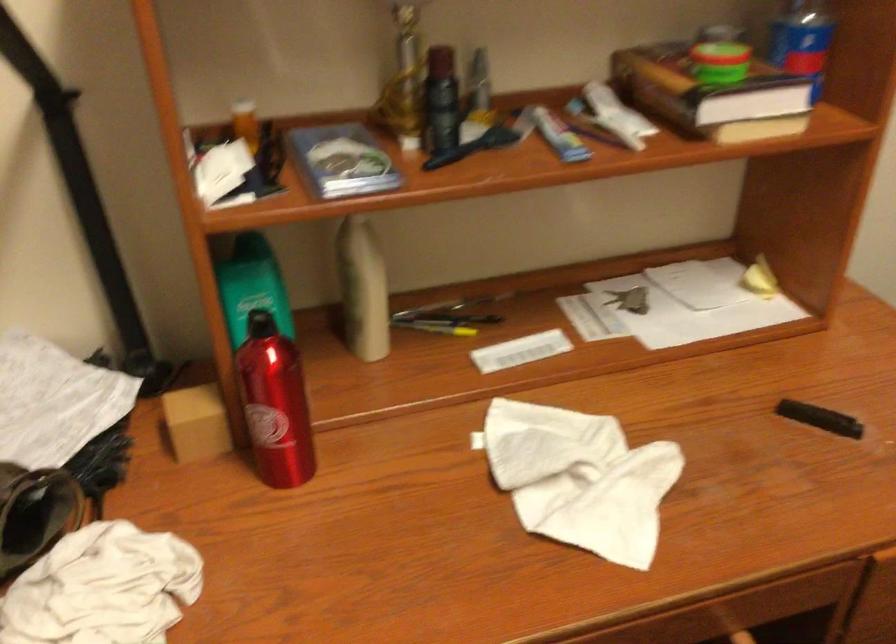
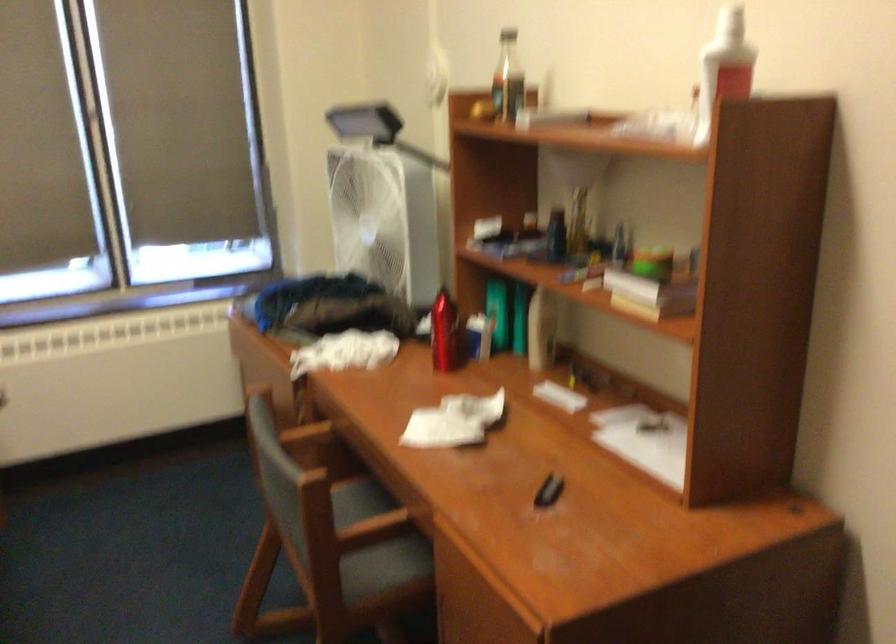
Find the pixel in the second image that matches pixel 303 406 in the first image.

(444, 333)